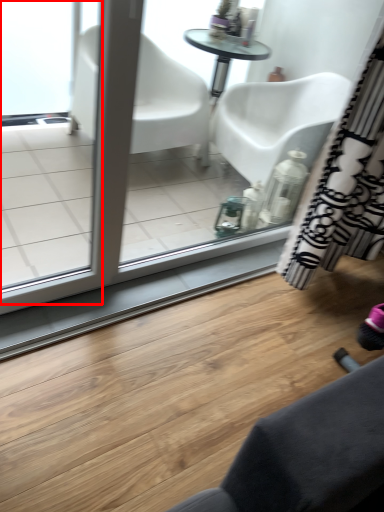
Question: From the image's perspective, what is the correct spatial positioning of screen door (annotated by the red box) in reference to curtain?

Choices:
 (A) below
 (B) above

Answer: (A)